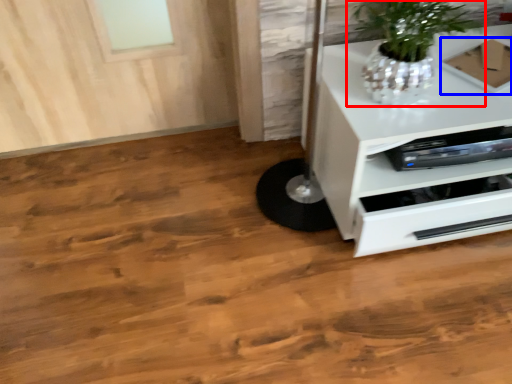
Question: Which of the following is the farthest to the observer, houseplant (highlighted by a red box) or cardboard box (highlighted by a blue box)?

Choices:
 (A) houseplant
 (B) cardboard box

Answer: (B)